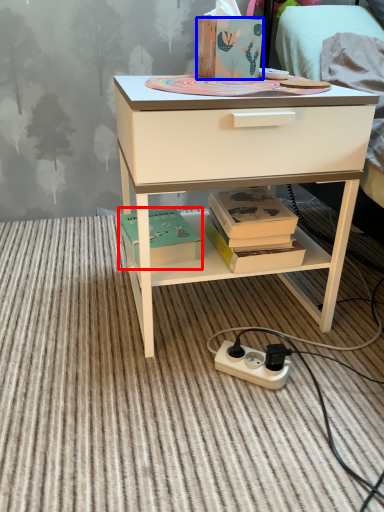
Question: Among these objects, which one is farthest to the camera, box (highlighted by a red box) or box (highlighted by a blue box)?

Choices:
 (A) box
 (B) box

Answer: (A)